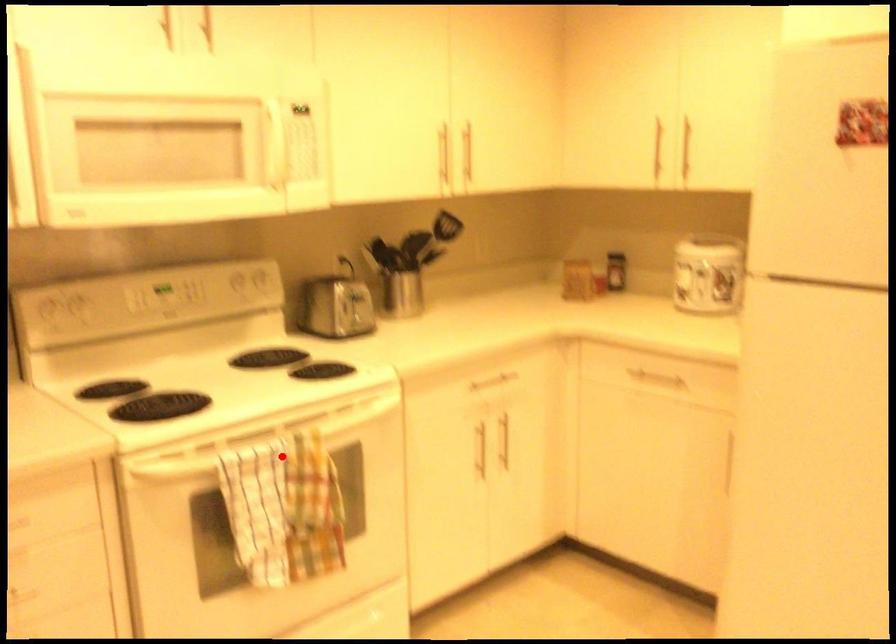
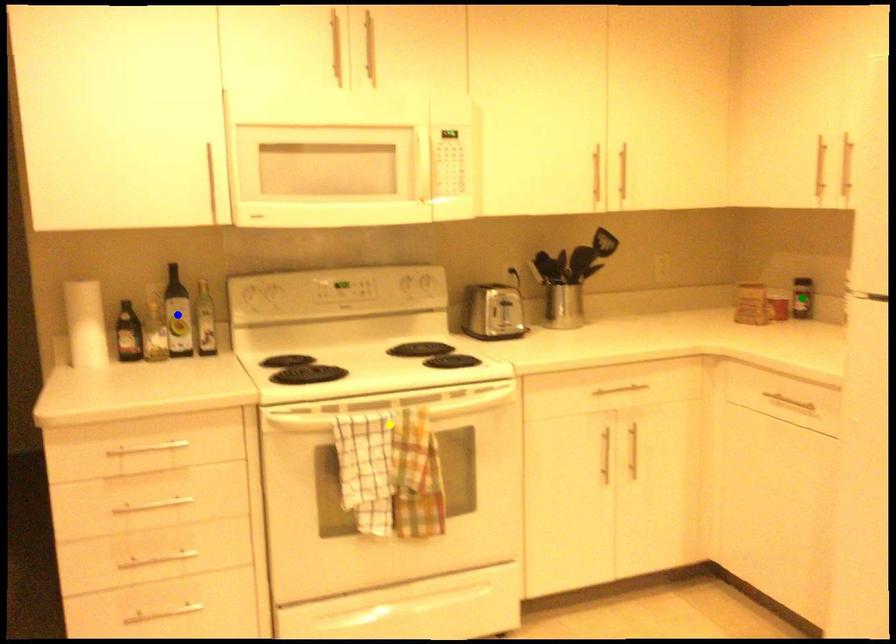
Question: I am providing you with two images of the same scene from different viewpoints. A red point is marked on the first image. You are given multiple points on the second image. Can you choose the point in image 2 that corresponds to the point in image 1?

Choices:
 (A) yellow point
 (B) green point
 (C) blue point

Answer: (A)